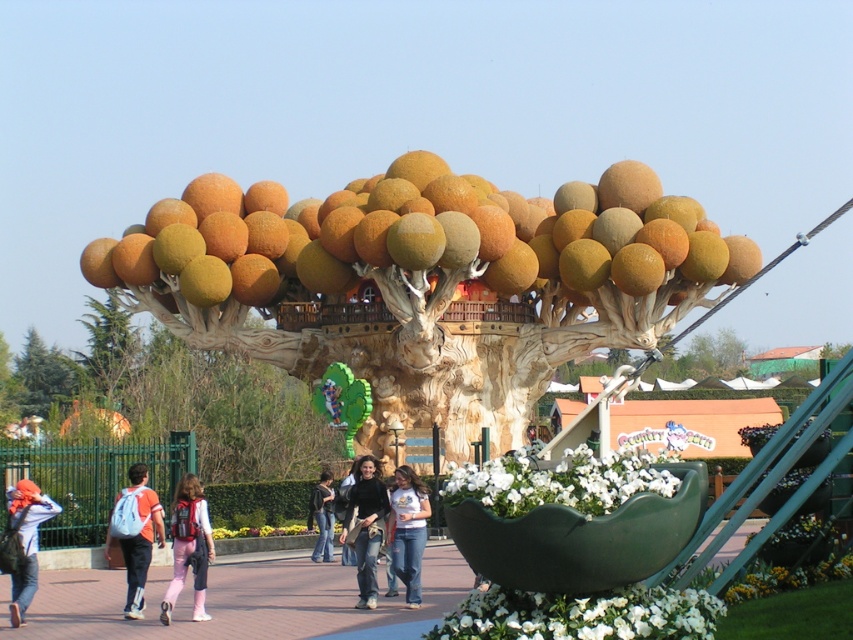
Who is shorter, dark brown leather jacket at center or denim jeans at center?

denim jeans at center is shorter.

Does dark brown leather jacket at center appear on the right side of denim jeans at center?

Incorrect, dark brown leather jacket at center is not on the right side of denim jeans at center.

Does point (361, 477) come behind point (395, 520)?

Yes, point (361, 477) is behind point (395, 520).

The image size is (853, 640). What are the coordinates of `dark brown leather jacket at center` in the screenshot? It's located at (364, 525).

Can you confirm if matte pink pants at center is positioned below green leafy tree at left?

Indeed, matte pink pants at center is positioned under green leafy tree at left.

In the scene shown: Does matte pink pants at center appear on the left side of green leafy tree at left?

Incorrect, matte pink pants at center is not on the left side of green leafy tree at left.

I want to click on matte pink pants at center, so pyautogui.click(x=189, y=547).

Does green leafy tree at left have a larger size compared to denim jeans at center?

Indeed, green leafy tree at left has a larger size compared to denim jeans at center.

Can you confirm if green leafy tree at left is shorter than denim jeans at center?

In fact, green leafy tree at left may be taller than denim jeans at center.

You are a GUI agent. You are given a task and a screenshot of the screen. Output one action in this format:
    pyautogui.click(x=<x>, y=<y>)
    Task: Click on the green leafy tree at left
    This screenshot has width=853, height=640.
    Given the screenshot: What is the action you would take?
    pyautogui.click(x=108, y=346)